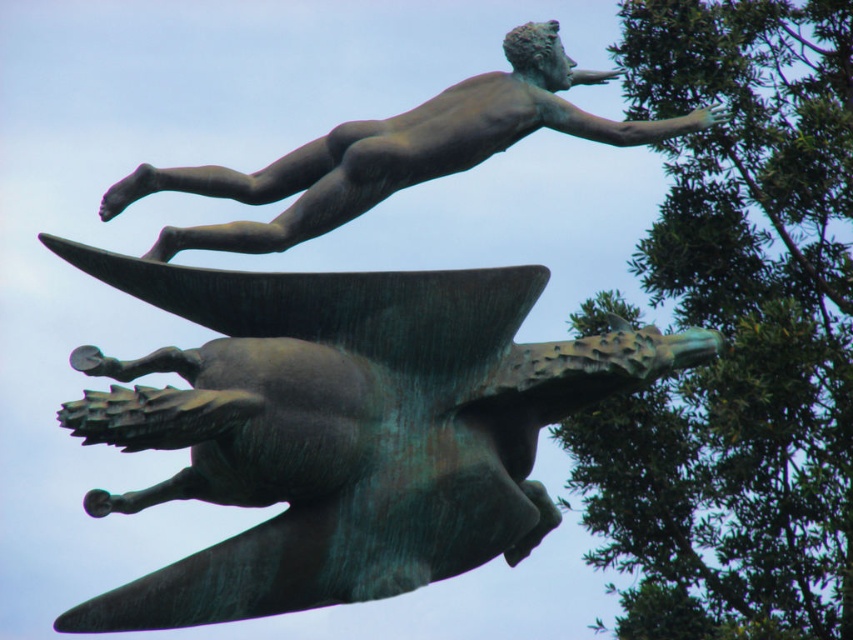
You are an art curator planning to install a new lighting system in the gallery. The green leafy tree at upper right and the bronze statue at upper center are both important focal points. Which object should have a spotlight placed higher to properly illuminate its top section?

The green leafy tree at upper right is much taller than the bronze statue at upper center, so the spotlight should be placed higher to illuminate the top of the green leafy tree at upper right.

You are standing at the base of the green leafy tree at upper right and want to take a photo of the sculpture. The camera you have can capture objects up to 400 feet away. Will you be able to take a clear photo of the sculpture with your camera?

The green leafy tree at upper right and camera are 430.48 feet apart, which exceeds the camera range of 400 feet. Therefore, you cannot take a clear photo of the sculpture with your camera.

You are an art conservator examining the bronze sculpture. You notice two points on the sculpture labeled as point (x=750, y=38) and point (x=720, y=118). From your vantage point, which of these points is closer to you?

Point (x=720, y=118) is closer to you because point (x=750, y=38) is behind it.